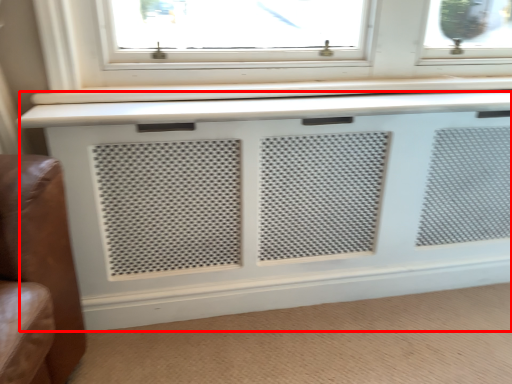
Question: From the image's perspective, what is the correct spatial positioning of air conditioning (annotated by the red box) in reference to plain?

Choices:
 (A) below
 (B) above

Answer: (B)